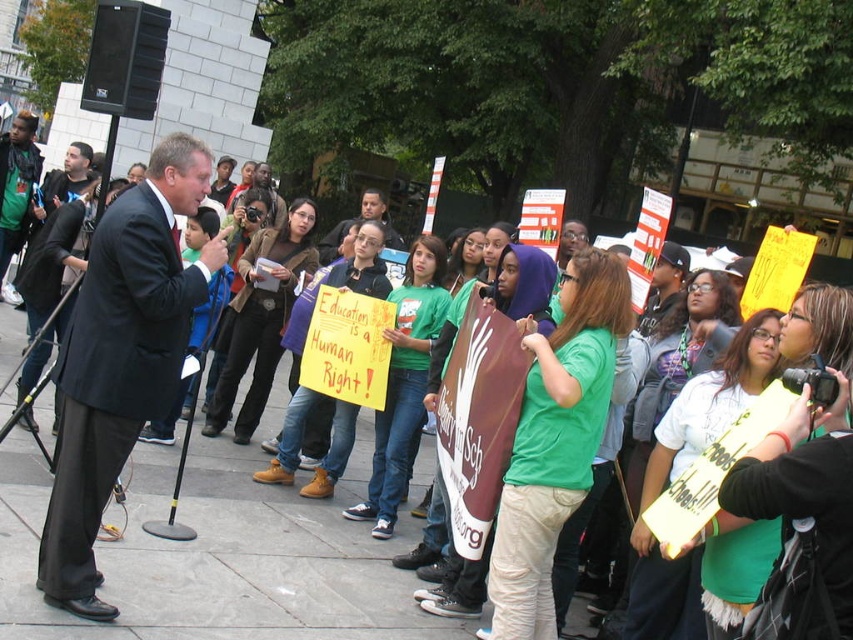
Can you confirm if black suit at left is positioned below matte black suit at center?

Yes.

Which is in front, point (138, 428) or point (335, 243)?

Positioned in front is point (138, 428).

Where is `black suit at left`? black suit at left is located at coordinates (120, 358).